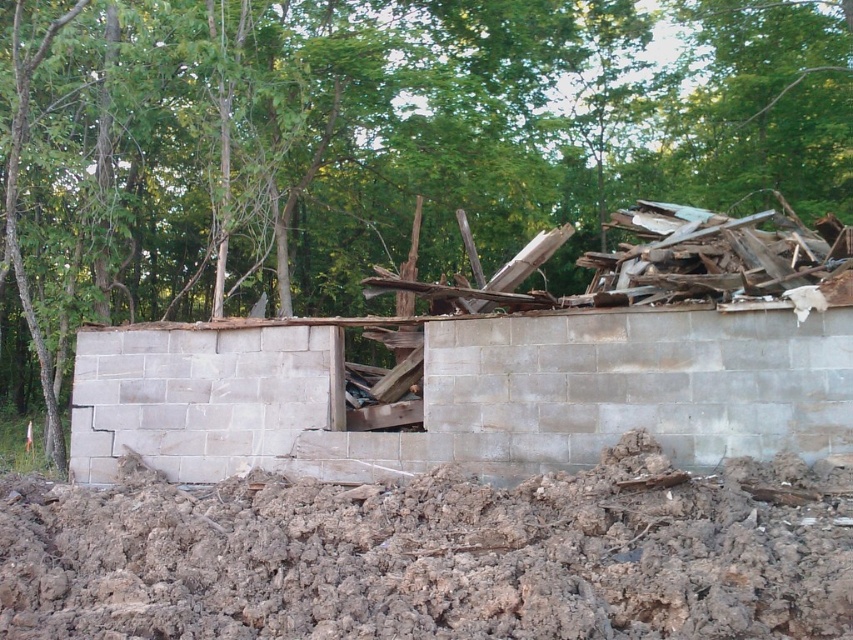
Consider the image. You are a construction worker standing at the point with coordinates point (537, 349). You need to reach the point with coordinates point (242, 170) to inspect debris. Can you see that point from your current position?

Point (242, 170) is behind point (537, 349), so you cannot see it directly from your current position at point (537, 349).

You are a construction worker assessing the stability of the gray concrete wall at center and the gray concrete block at center. Given the distance between them, can you safely place a 30 cm wide support beam between them to reinforce the structure?

The gray concrete wall at center and gray concrete block at center are 30.58 centimeters apart. Since the support beam is 30 cm wide, it can fit between them with a small gap of 0.58 centimeters remaining. This should be feasible, but ensure the beam is properly secured to maintain stability.